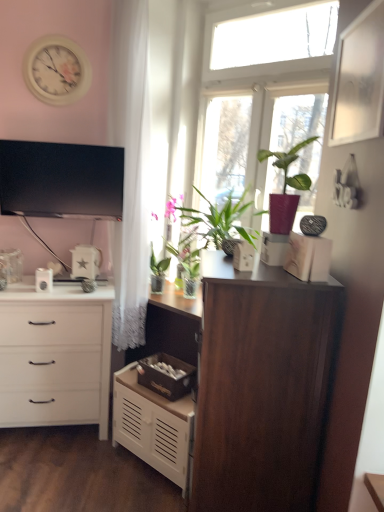
Question: Can you confirm if white glossy kettle at left, which is counted as the second appliance, starting from the front, is shorter than white matte chest of drawers at left, acting as the 1th chest of drawers starting from the left?

Choices:
 (A) no
 (B) yes

Answer: (B)

Question: Can you confirm if white glossy kettle at left, the 2th appliance viewed from the back, is thinner than white matte chest of drawers at left, acting as the 1th chest of drawers starting from the left?

Choices:
 (A) yes
 (B) no

Answer: (A)

Question: Is white glossy kettle at left, which is counted as the second appliance, starting from the front, closer to camera compared to white matte chest of drawers at left, acting as the 1th chest of drawers starting from the left?

Choices:
 (A) yes
 (B) no

Answer: (B)

Question: Is white glossy kettle at left, the third appliance when ordered from right to left, taller than white matte chest of drawers at left, which appears as the 2th chest of drawers when viewed from the right?

Choices:
 (A) yes
 (B) no

Answer: (B)

Question: Is white glossy kettle at left, the first appliance when ordered from left to right, far away from white matte chest of drawers at left, which appears as the 2th chest of drawers when viewed from the right?

Choices:
 (A) no
 (B) yes

Answer: (A)

Question: From the image's perspective, is white matte chest of drawers at lower center, which is the 1th chest of drawers in right-to-left order, above or below white glossy clock at upper left?

Choices:
 (A) below
 (B) above

Answer: (A)

Question: Considering the positions of white matte chest of drawers at lower center, positioned as the 2th chest of drawers in left-to-right order, and white glossy clock at upper left in the image, is white matte chest of drawers at lower center, positioned as the 2th chest of drawers in left-to-right order, taller or shorter than white glossy clock at upper left?

Choices:
 (A) tall
 (B) short

Answer: (A)

Question: Would you say white matte chest of drawers at lower center, which is the 1th chest of drawers in right-to-left order, is to the left or to the right of white glossy clock at upper left in the picture?

Choices:
 (A) left
 (B) right

Answer: (B)

Question: Is point (147, 441) closer or farther from the camera than point (44, 59)?

Choices:
 (A) farther
 (B) closer

Answer: (B)

Question: Which is correct: dark wood cupboard at center is inside clear glass window at upper center, or outside of it?

Choices:
 (A) outside
 (B) inside

Answer: (A)

Question: In terms of height, does dark wood cupboard at center look taller or shorter compared to clear glass window at upper center?

Choices:
 (A) short
 (B) tall

Answer: (A)

Question: Would you say dark wood cupboard at center is to the left or to the right of clear glass window at upper center in the picture?

Choices:
 (A) right
 (B) left

Answer: (B)

Question: In the image, is dark wood cupboard at center positioned in front of or behind clear glass window at upper center?

Choices:
 (A) front
 (B) behind

Answer: (A)

Question: From a real-world perspective, is white glossy star-shaped object at center, which is the second appliance in left-to-right order, physically located above or below white glossy toaster at center, which is counted as the 1th appliance, starting from the right?

Choices:
 (A) below
 (B) above

Answer: (A)

Question: Is point (97, 268) closer or farther from the camera than point (248, 263)?

Choices:
 (A) farther
 (B) closer

Answer: (A)